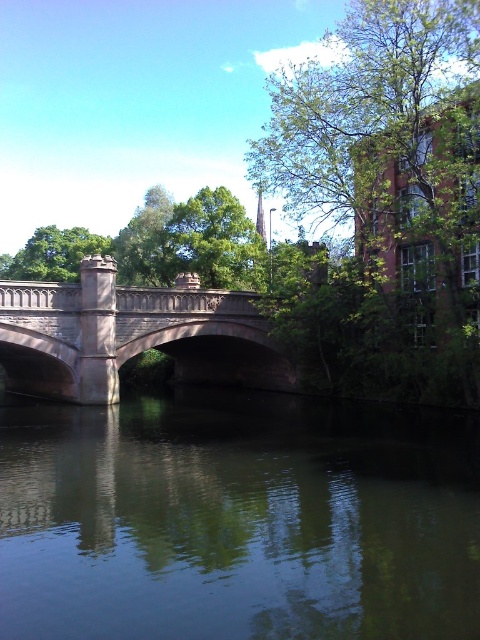
Based on the photo, you are standing at the center of the stone bridge and want to locate the green reflective water at center. According to the coordinates, where should you look relative to your position?

The green reflective water at center is located at coordinates point (238, 518), so you should look slightly to the right and down from your current position on the stone bridge.